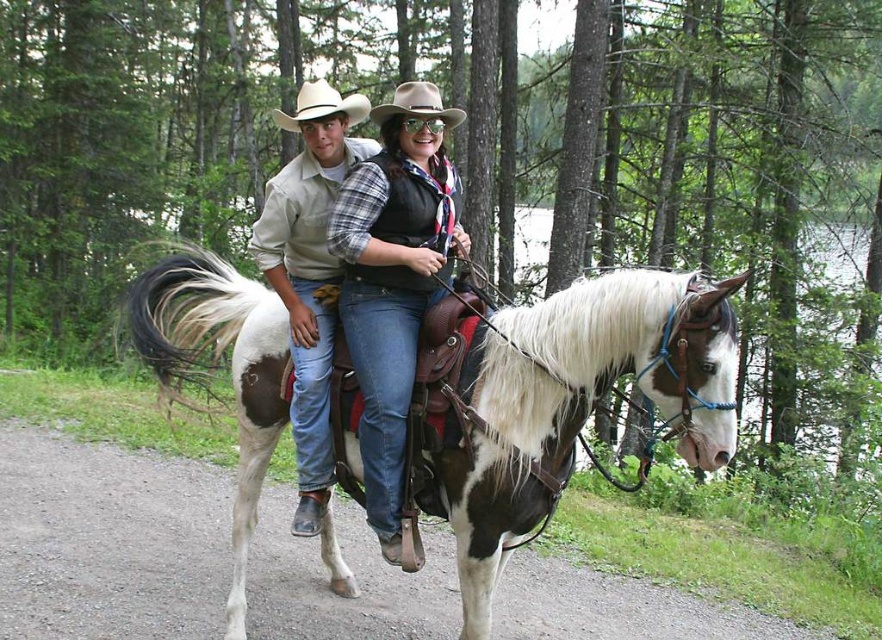
You are a photographer taking a picture of the painted leather saddle at center and the light brown felt cowboy hat at upper center. Which object should you focus on first if you want to capture both in the same frame without moving your camera?

The painted leather saddle at center is located below the light brown felt cowboy hat at upper center, so you should focus on the light brown felt cowboy hat at upper center first to ensure both are in the frame.

You are a photographer trying to capture a clear photo of the matte black vest at center and the beige felt cowboy hat at center. Since you want to focus on the vest, which object should you adjust your camera to focus on first, considering their heights?

The matte black vest at center is not as tall as the beige felt cowboy hat at center. Therefore, you should focus on the beige felt cowboy hat at center first because it is taller and might be more prominent in the frame.

You are a photographer trying to capture a closeup of the painted leather saddle at center and the light brown felt cowboy hat at upper center. Since you want both objects to be clearly visible in the photo, which object should you zoom in on more?

The painted leather saddle at center occupies less space than the light brown felt cowboy hat at upper center, so you should zoom in more on the painted leather saddle at center to ensure both are clearly visible.